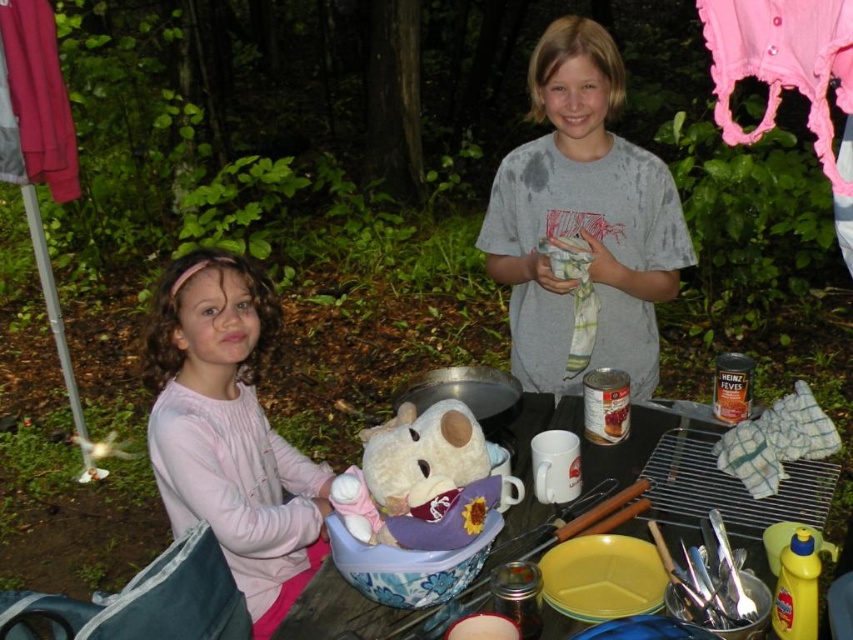
Question: Is gray cotton shirt at center to the left of floral plastic bowl at center from the viewer's perspective?

Choices:
 (A) no
 (B) yes

Answer: (A)

Question: Is pink cotton shirt at left bigger than pink fabric at upper left?

Choices:
 (A) no
 (B) yes

Answer: (B)

Question: Which object appears farthest from the camera in this image?

Choices:
 (A) floral plastic bowl at center
 (B) pink fabric at upper left

Answer: (B)

Question: Estimate the real-world distances between objects in this image. Which object is closer to the pink fabric at upper left?

Choices:
 (A) floral plastic bowl at center
 (B) gray cotton shirt at center
 (C) pink cotton shirt at left

Answer: (C)

Question: Is gray cotton shirt at center in front of pink cotton shirt at left?

Choices:
 (A) no
 (B) yes

Answer: (A)

Question: Which object is closer to the camera taking this photo?

Choices:
 (A) pink fabric at upper left
 (B) gray cotton shirt at center
 (C) fluffy white teddy bear at center
 (D) pink cotton shirt at left

Answer: (C)